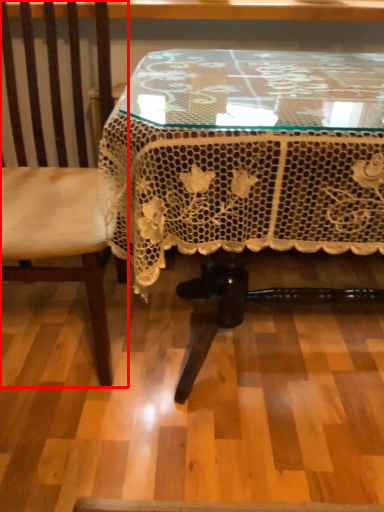
Question: From the image's perspective, where is chair (annotated by the red box) located relative to table?

Choices:
 (A) above
 (B) below

Answer: (A)